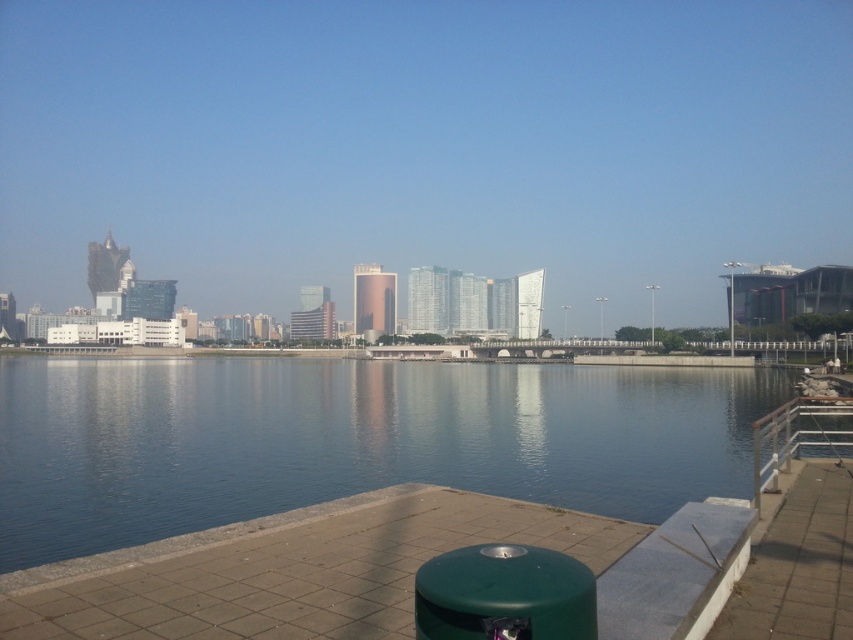
Between blue glassy water at center and silver metallic railing at lower right, which one is positioned higher?

Positioned higher is silver metallic railing at lower right.

The height and width of the screenshot is (640, 853). What do you see at coordinates (350, 440) in the screenshot?
I see `blue glassy water at center` at bounding box center [350, 440].

Who is more forward, (125, 435) or (769, 420)?

Point (769, 420)

Find the location of a particular element. This screenshot has width=853, height=640. blue glassy water at center is located at coordinates (350, 440).